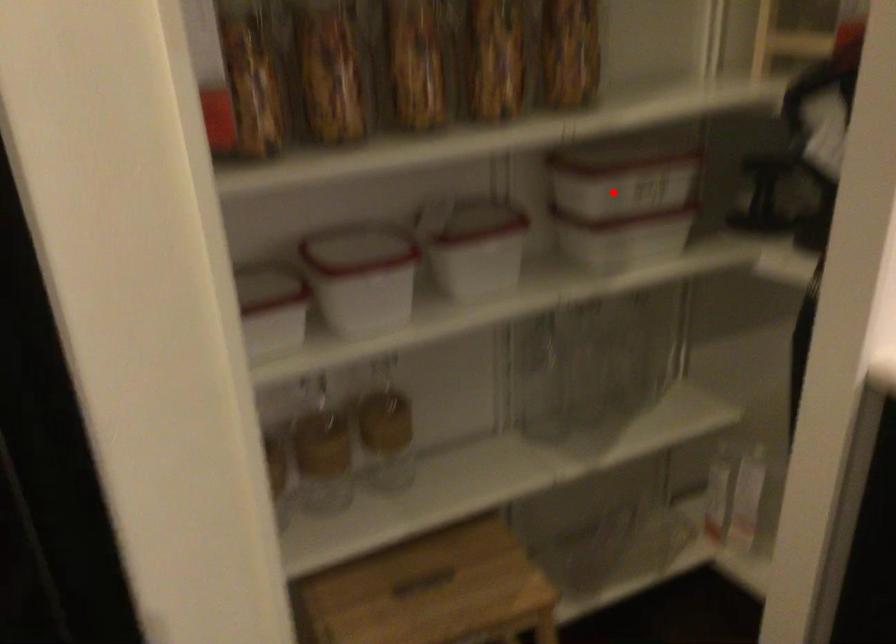
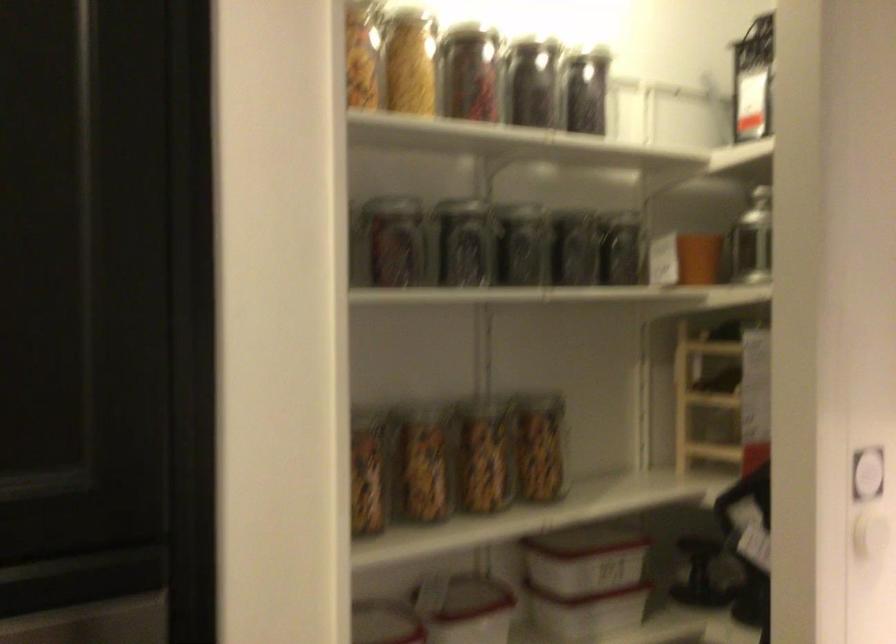
Locate, in the second image, the point that corresponds to the highlighted location in the first image.

(582, 572)